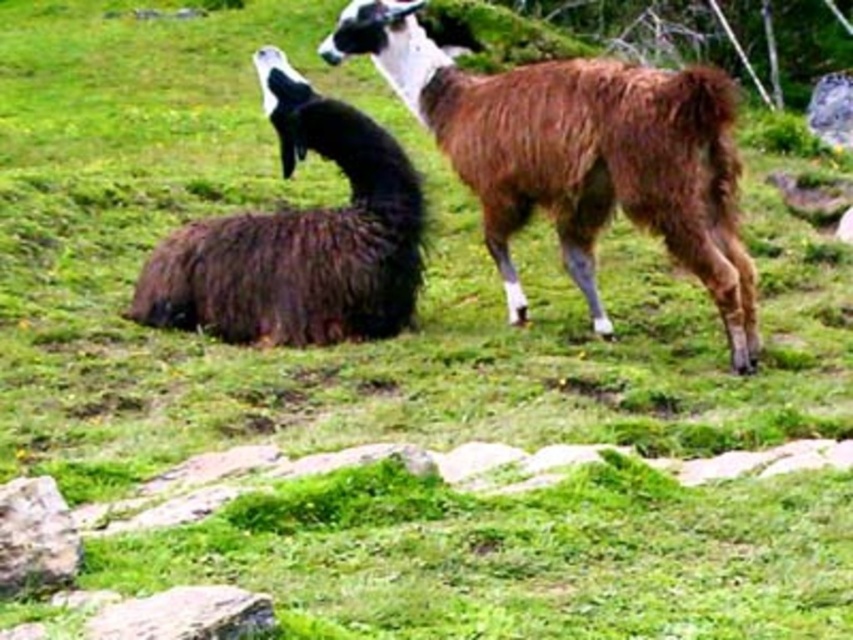
You are a photographer standing 5 meters away from the camera position. You want to take a photo of the brown woolly alpaca at center. Can you move closer to get a better shot without exceeding the maximum distance of 5 meters?

The brown woolly alpaca at center is 5.39 meters away from the camera. Since you are already 5 meters away, you cannot move closer without exceeding the maximum distance of 5 meters. You need to stay at your current position to ensure the alpaca is within range.

You are a farmer who needs to fit both the brown woolly alpaca at center and the dark brown woolen goat at center into a 2.5 meter wide barn. Given their sizes, can both animals fit side by side without overlapping?

The brown woolly alpaca at center is wider than the dark brown woolen goat at center. However, without knowing their exact combined widths, it is impossible to determine if they can fit into the 2.5 meter wide barn.

You are a farmer who wants to build a fence around the area where both the brown woolly alpaca at center and the dark brown woolen goat at center are located. Since the alpaca is taller, which animal requires a taller fence to prevent it from jumping out?

The brown woolly alpaca at center requires a taller fence because it has a greater height compared to the dark brown woolen goat at center.